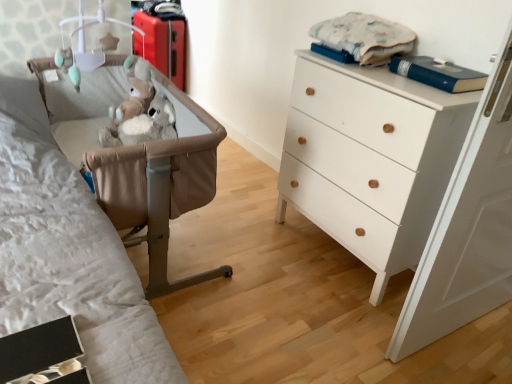
Question: Considering the positions of point (77, 52) and point (138, 33), is point (77, 52) closer or farther from the camera than point (138, 33)?

Choices:
 (A) farther
 (B) closer

Answer: (B)

Question: From their relative heights in the image, would you say white plastic mobile at upper left is taller or shorter than matte red suitcase at upper left?

Choices:
 (A) short
 (B) tall

Answer: (A)

Question: Based on their relative distances, which object is farther from the white wood chest of drawers at right?

Choices:
 (A) matte red suitcase at upper left
 (B) tan leather crib at left
 (C) white plastic mobile at upper left
 (D) blue hardcover book at upper right

Answer: (A)

Question: Which is farther from the tan leather crib at left?

Choices:
 (A) white wood chest of drawers at right
 (B) white plastic mobile at upper left
 (C) blue hardcover book at upper right
 (D) matte red suitcase at upper left

Answer: (D)